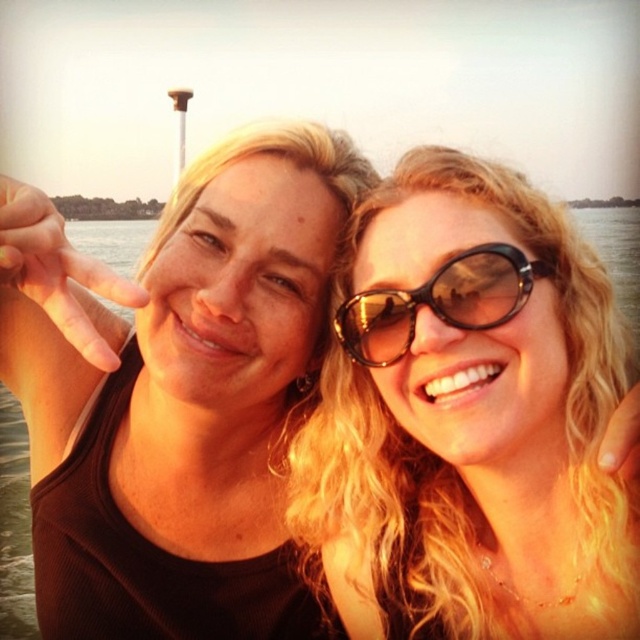
You are a photographer trying to capture the reflection of the black plastic sunglasses at center in the transparent water at center. Based on the scene, can you confirm if the reflection will be visible?

The transparent water at center is much taller as black plastic sunglasses at center, so the reflection of the black plastic sunglasses at center may not be fully visible because the water is deeper than the sunglasses.